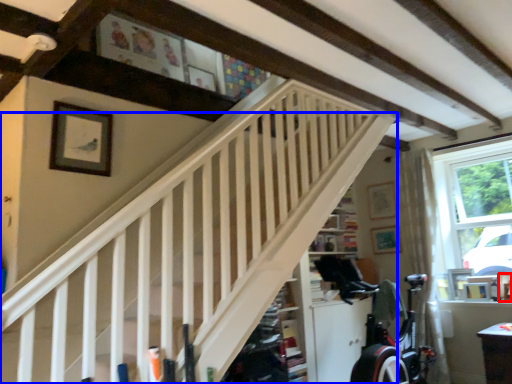
Question: Among these objects, which one is nearest to the camera, picture frame (highlighted by a red box) or stairs (highlighted by a blue box)?

Choices:
 (A) picture frame
 (B) stairs

Answer: (B)